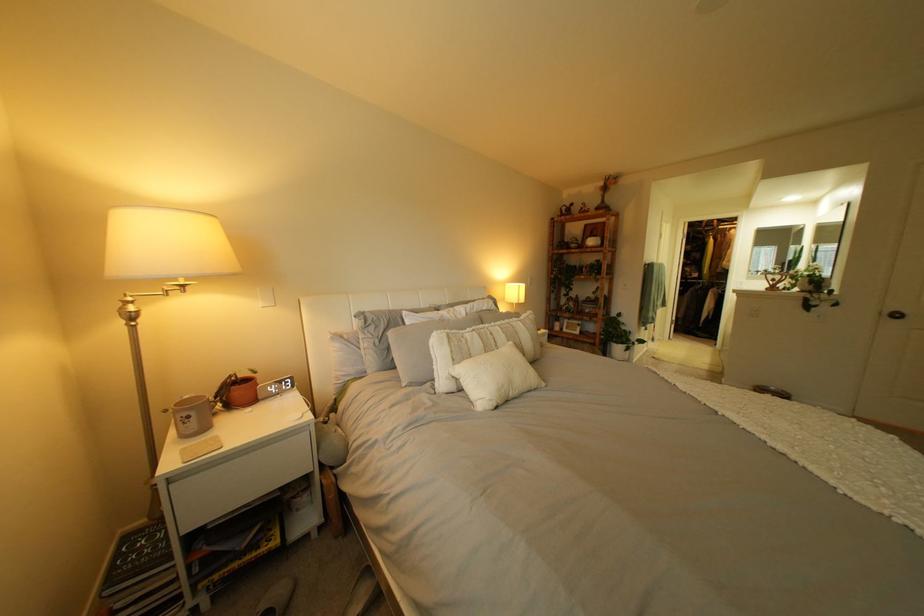
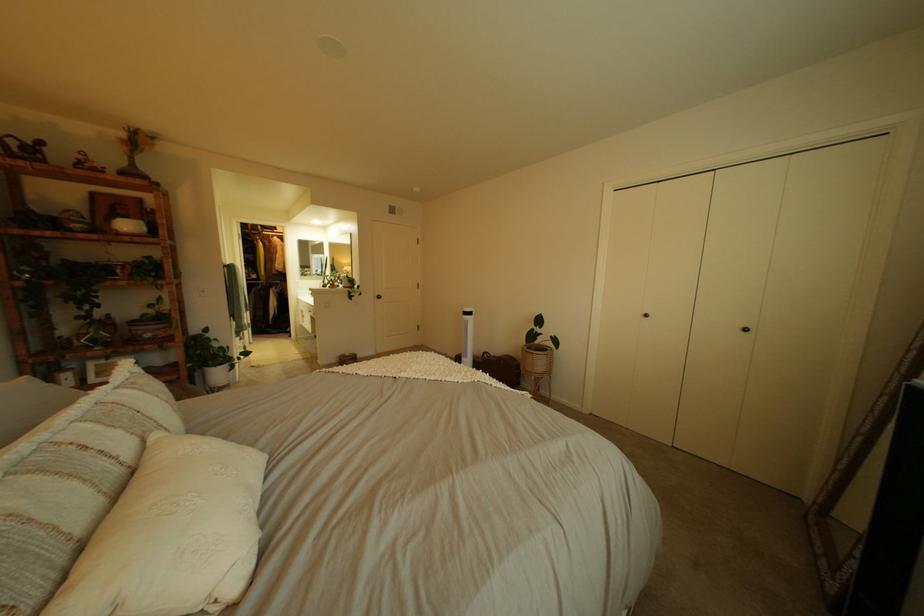
Find the pixel in the second image that matches point 603,299 in the first image.

(161, 315)